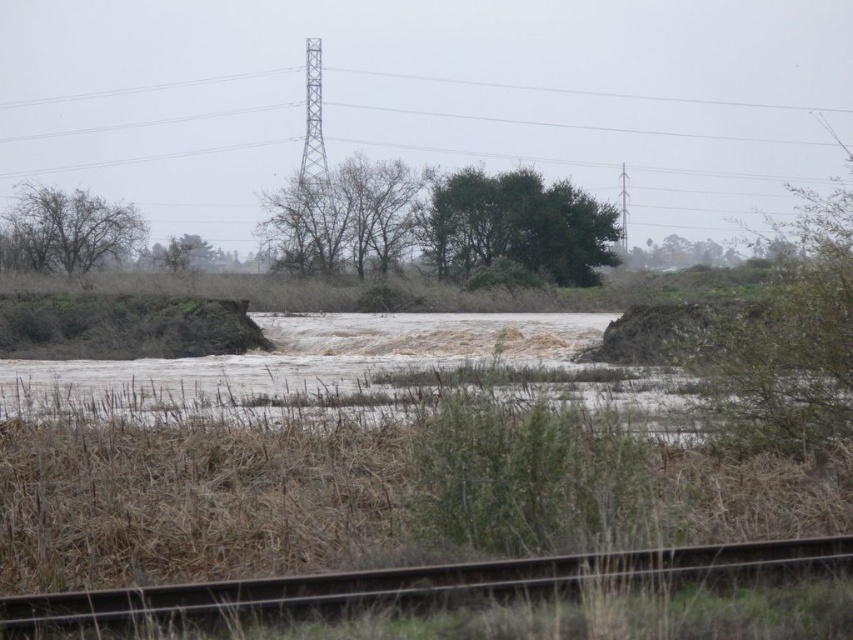
Is bare branches at center in front of green leafy tree at left?

That is False.

Based on the photo, is bare branches at center thinner than green leafy tree at left?

Correct, bare branches at center's width is less than green leafy tree at left's.

Which is in front, point (395, 252) or point (62, 253)?

Point (395, 252) is more forward.

Find the location of a particular element. The width and height of the screenshot is (853, 640). bare branches at center is located at coordinates (345, 218).

Measure the distance from rusty metal train track at lower center to green leafy tree at left.

rusty metal train track at lower center is 273.85 feet away from green leafy tree at left.

Does rusty metal train track at lower center have a larger size compared to green leafy tree at left?

Actually, rusty metal train track at lower center might be smaller than green leafy tree at left.

What do you see at coordinates (410, 580) in the screenshot?
I see `rusty metal train track at lower center` at bounding box center [410, 580].

Where is `rusty metal train track at lower center`? The image size is (853, 640). rusty metal train track at lower center is located at coordinates (410, 580).

Is green leafy tree at center behind green leafy tree at left?

That is False.

Image resolution: width=853 pixels, height=640 pixels. What do you see at coordinates (518, 227) in the screenshot?
I see `green leafy tree at center` at bounding box center [518, 227].

Locate an element on the screen. green leafy tree at center is located at coordinates (518, 227).